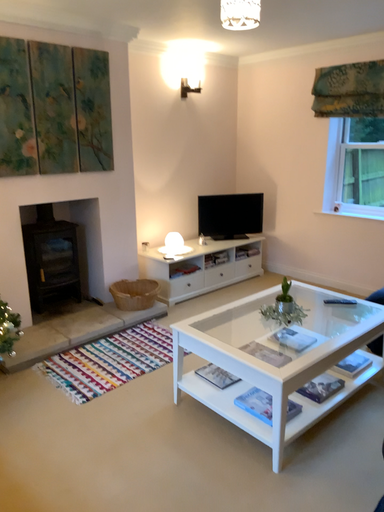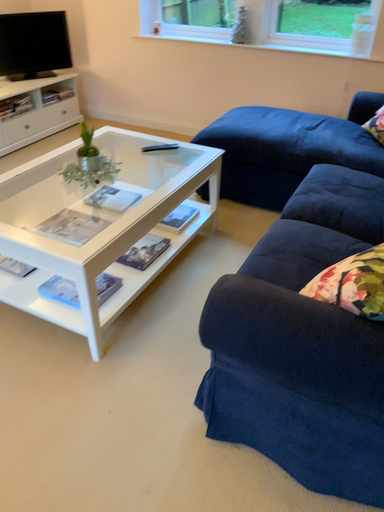
Question: Which way did the camera rotate in the video?

Choices:
 (A) rotated downward
 (B) rotated upward

Answer: (A)